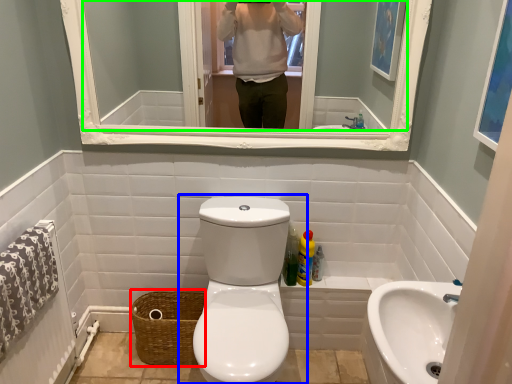
Question: Which is nearer to the basket (highlighted by a red box)? toilet (highlighted by a blue box) or mirror (highlighted by a green box).

Choices:
 (A) toilet
 (B) mirror

Answer: (A)